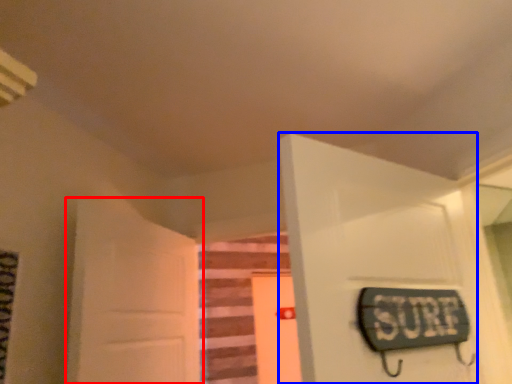
Question: Which point is closer to the camera, door (highlighted by a red box) or door (highlighted by a blue box)?

Choices:
 (A) door
 (B) door

Answer: (B)